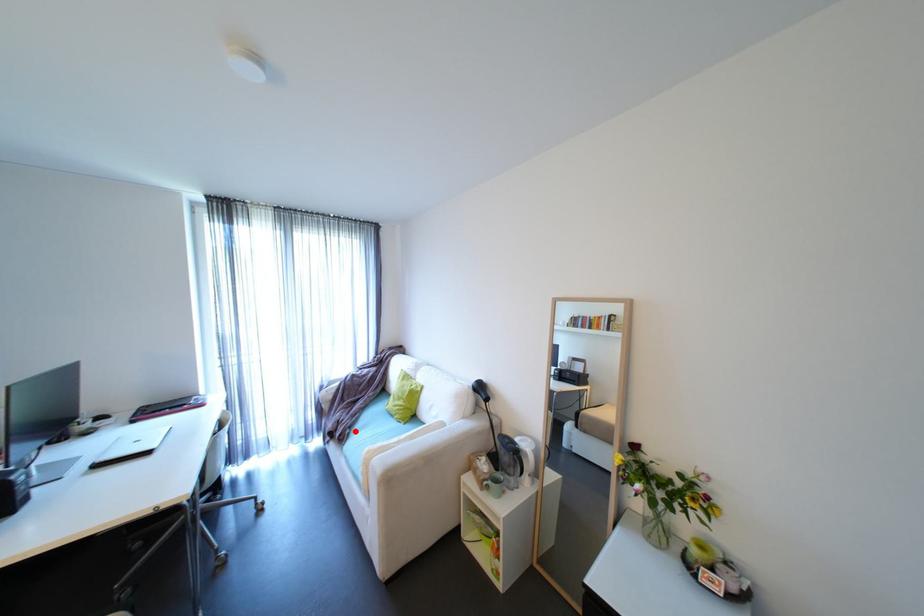
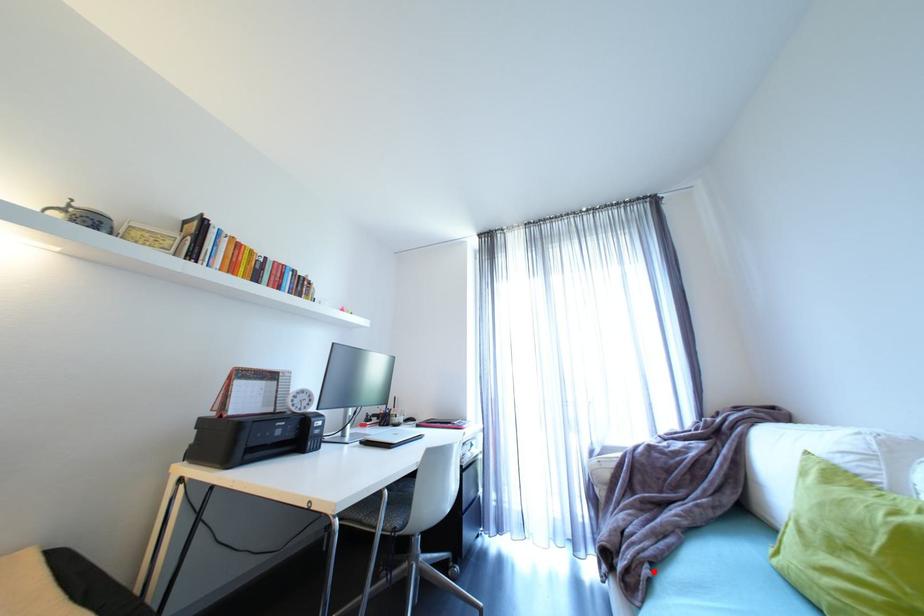
I am providing you with two images of the same scene from different viewpoints. A red point is marked on the first image and another point is marked on the second image. Are the points marked in image1 and image2 representing the same 3D position?

Yes